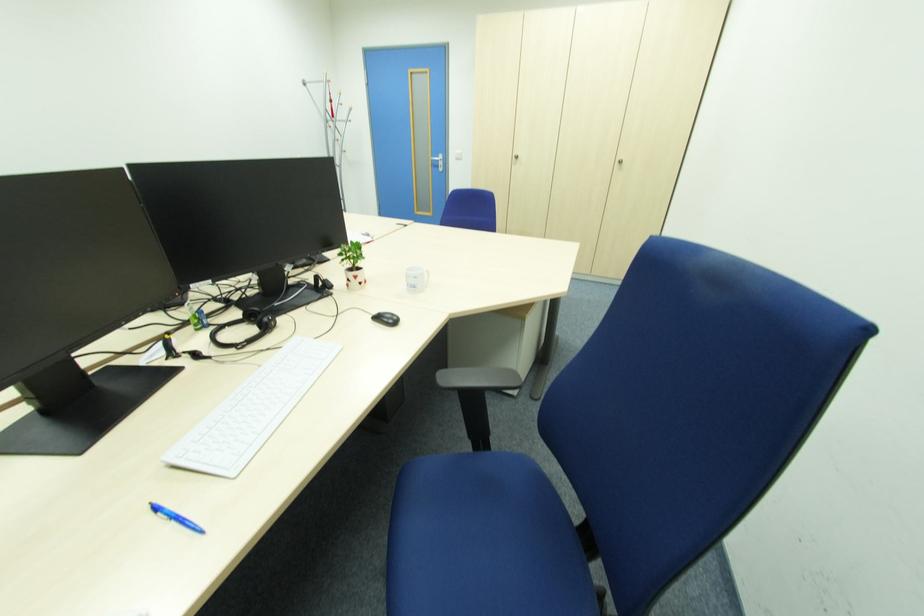
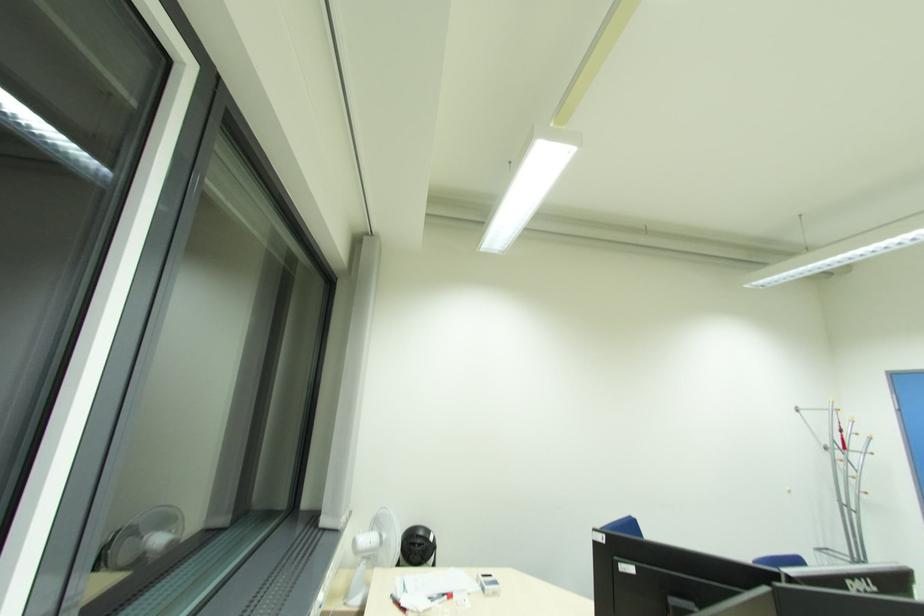
First-person continuous shooting, in which direction is the camera rotating?

The rotation direction of the camera is left-up.